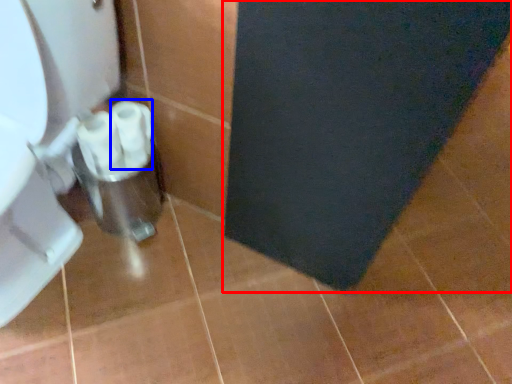
Question: Which of the following is the closest to the observer, bath mat (highlighted by a red box) or toilet paper (highlighted by a blue box)?

Choices:
 (A) bath mat
 (B) toilet paper

Answer: (A)